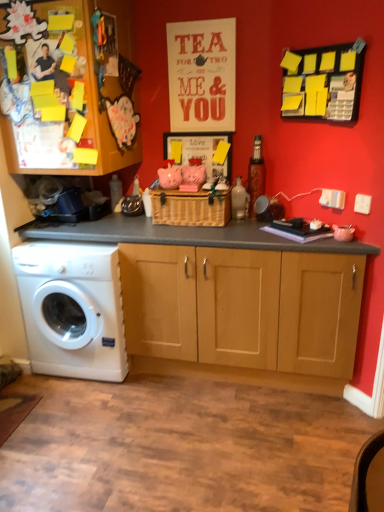
Where is `vacant space in front of white plastic washing machine at lower left`? This screenshot has width=384, height=512. vacant space in front of white plastic washing machine at lower left is located at coordinates (81, 418).